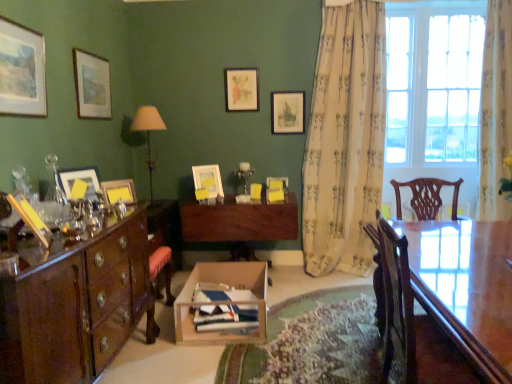
Locate an element on the screen. The height and width of the screenshot is (384, 512). free location above matte yellow picture frame at center, which is counted as the fifth picture frame, starting from the left (from a real-world perspective) is located at coordinates coord(206,167).